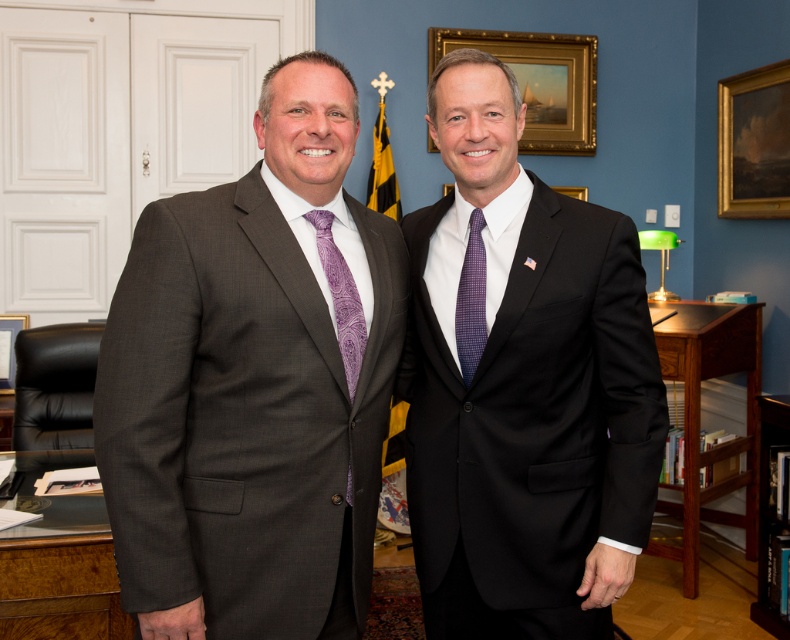
In the scene shown: Is purple paisley tie at center closer to camera compared to brushed metal picture frame at left?

That is True.

Describe the element at coordinates (340, 298) in the screenshot. I see `purple paisley tie at center` at that location.

Locate an element on the screen. This screenshot has height=640, width=790. purple paisley tie at center is located at coordinates (340, 298).

Does gold/gilded picture frame at upper center have a greater width compared to brushed metal picture frame at left?

Indeed, gold/gilded picture frame at upper center has a greater width compared to brushed metal picture frame at left.

From the picture: Is gold/gilded picture frame at upper center below brushed metal picture frame at left?

Actually, gold/gilded picture frame at upper center is above brushed metal picture frame at left.

Is point (533, 122) closer to camera compared to point (0, 332)?

No, it is behind (0, 332).

Image resolution: width=790 pixels, height=640 pixels. Identify the location of gold/gilded picture frame at upper center. (540, 83).

Is point (483, 394) farther from camera compared to point (574, 192)?

No, it is not.

Is point (562, 216) positioned in front of point (581, 186)?

That is True.

Which is in front, point (585, 632) or point (561, 188)?

Positioned in front is point (585, 632).

What are the coordinates of `matte black suit at right` in the screenshot? It's located at (525, 387).